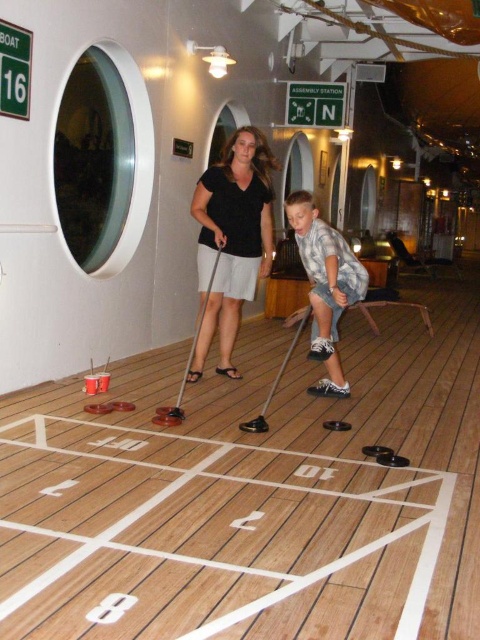
You are observing two people playing shuffleboard on a ship deck. You notice a black matte shirt at center and a checkered fabric shirt at center. Which shirt is located to the left of the other?

The black matte shirt at center is positioned on the left side of checkered fabric shirt at center.

You are a photographer trying to capture the scene of the black matte shirt at center and the checkered fabric shirt at center. Which one is positioned higher in the image?

The black matte shirt at center is above the checkered fabric shirt at center, so the black matte shirt at center is higher in the image.